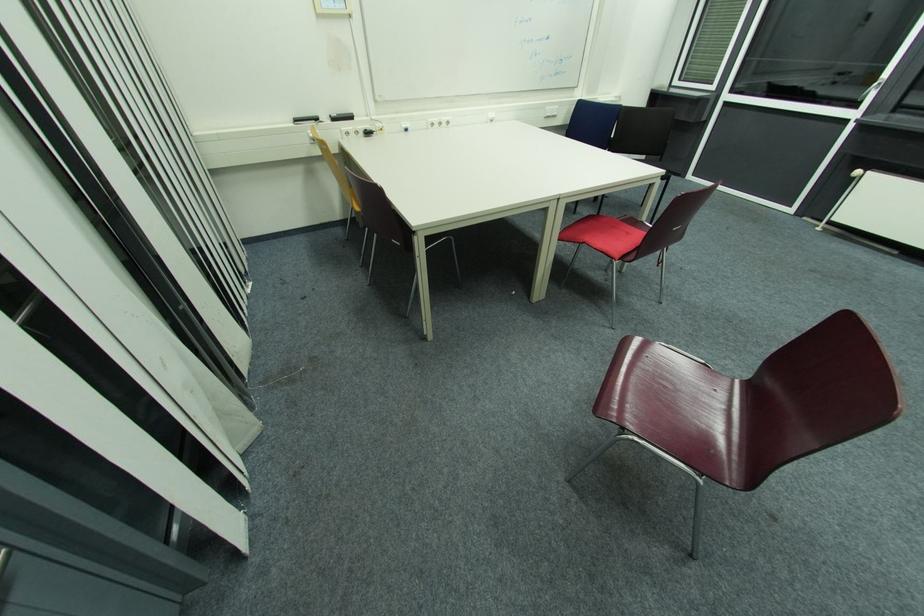
The height and width of the screenshot is (616, 924). I want to click on white window handle, so click(x=870, y=89).